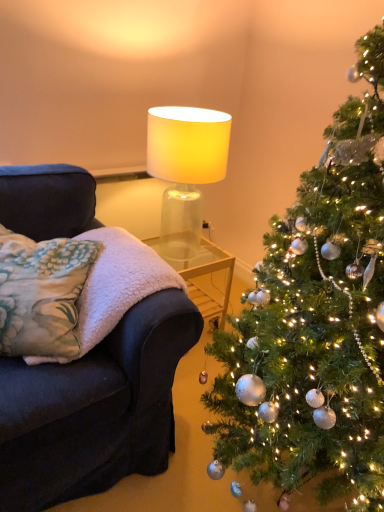
Find the location of a particular element. The height and width of the screenshot is (512, 384). fluffy floral pillow at left is located at coordinates (42, 293).

What do you see at coordinates (42, 293) in the screenshot?
I see `fluffy floral pillow at left` at bounding box center [42, 293].

Identify the location of translucent glass lampshade at upper center. (185, 169).

Does translucent glass lampshade at upper center turn towards fluffy white blanket at left?

Yes, translucent glass lampshade at upper center is oriented towards fluffy white blanket at left.

Which of these two, translucent glass lampshade at upper center or fluffy white blanket at left, is thinner?

With smaller width is translucent glass lampshade at upper center.

From a real-world perspective, is translucent glass lampshade at upper center under fluffy white blanket at left?

No, from a real-world perspective, translucent glass lampshade at upper center is not under fluffy white blanket at left.

Between translucent glass lampshade at upper center and fluffy white blanket at left, which one has smaller size?

With smaller size is translucent glass lampshade at upper center.

Which is correct: shiny silver ornaments at right is inside translucent glass lampshade at upper center, or outside of it?

shiny silver ornaments at right lies outside translucent glass lampshade at upper center.

Between shiny silver ornaments at right and translucent glass lampshade at upper center, which one has larger size?

Bigger between the two is shiny silver ornaments at right.

Is shiny silver ornaments at right far from translucent glass lampshade at upper center?

That's not correct — shiny silver ornaments at right is a little close to translucent glass lampshade at upper center.

From the image's perspective, which one is positioned lower, shiny silver ornaments at right or translucent glass lampshade at upper center?

From the image's view, shiny silver ornaments at right is below.

Considering their positions, is fluffy white blanket at left located in front of or behind translucent glass lampshade at upper center?

Clearly, fluffy white blanket at left is in front of translucent glass lampshade at upper center.

This screenshot has width=384, height=512. What are the coordinates of `blanket on the left side of translucent glass lampshade at upper center` in the screenshot? It's located at (118, 282).

Is fluffy white blanket at left facing towards translucent glass lampshade at upper center?

No, fluffy white blanket at left is not oriented towards translucent glass lampshade at upper center.

Considering the sizes of objects fluffy floral pillow at left and translucent glass lampshade at upper center in the image provided, who is shorter, fluffy floral pillow at left or translucent glass lampshade at upper center?

Standing shorter between the two is fluffy floral pillow at left.

Is fluffy floral pillow at left oriented towards translucent glass lampshade at upper center?

No, fluffy floral pillow at left is not turned towards translucent glass lampshade at upper center.

Between fluffy floral pillow at left and translucent glass lampshade at upper center, which one has larger width?

fluffy floral pillow at left.

Is the surface of fluffy floral pillow at left in direct contact with translucent glass lampshade at upper center?

fluffy floral pillow at left and translucent glass lampshade at upper center are clearly separated.

From a real-world perspective, is fluffy floral pillow at left above or below shiny silver ornaments at right?

From a real-world perspective, fluffy floral pillow at left is physically below shiny silver ornaments at right.

Can you confirm if fluffy floral pillow at left is thinner than shiny silver ornaments at right?

Yes.

Can you confirm if translucent glass lampshade at upper center is thinner than fluffy floral pillow at left?

Yes, translucent glass lampshade at upper center is thinner than fluffy floral pillow at left.

Is translucent glass lampshade at upper center facing away from fluffy floral pillow at left?

No, fluffy floral pillow at left is not at the back of translucent glass lampshade at upper center.

Considering the positions of points (152, 155) and (23, 243), is point (152, 155) farther from camera compared to point (23, 243)?

Yes, it is.

Do you think fluffy white blanket at left is within shiny silver ornaments at right, or outside of it?

fluffy white blanket at left is spatially situated outside shiny silver ornaments at right.

Which object is positioned more to the left, fluffy white blanket at left or shiny silver ornaments at right?

fluffy white blanket at left is more to the left.

From a real-world perspective, who is located higher, fluffy white blanket at left or shiny silver ornaments at right?

shiny silver ornaments at right.

Where is `blanket below the shiny silver ornaments at right (from a real-world perspective)`? blanket below the shiny silver ornaments at right (from a real-world perspective) is located at coordinates (118, 282).

What are the coordinates of `lamp above the fluffy white blanket at left (from a real-world perspective)` in the screenshot? It's located at 185,169.

In order to click on lamp behind the shiny silver ornaments at right in this screenshot , I will do `click(185, 169)`.

When comparing their distances from fluffy white blanket at left, does fluffy floral pillow at left or translucent glass lampshade at upper center seem further?

translucent glass lampshade at upper center is positioned further to the anchor fluffy white blanket at left.

When comparing their distances from shiny silver ornaments at right, does fluffy white blanket at left or translucent glass lampshade at upper center seem closer?

Among the two, fluffy white blanket at left is located nearer to shiny silver ornaments at right.

Which object lies further to the anchor point fluffy floral pillow at left, translucent glass lampshade at upper center or fluffy white blanket at left?

translucent glass lampshade at upper center is positioned further to the anchor fluffy floral pillow at left.

From the image, which object appears to be nearer to fluffy floral pillow at left, fluffy white blanket at left or shiny silver ornaments at right?

fluffy white blanket at left.

From the image, which object appears to be farther from translucent glass lampshade at upper center, fluffy white blanket at left or shiny silver ornaments at right?

shiny silver ornaments at right lies further to translucent glass lampshade at upper center than the other object.

Considering their positions, is translucent glass lampshade at upper center positioned closer to fluffy floral pillow at left than shiny silver ornaments at right?

Based on the image, shiny silver ornaments at right appears to be nearer to fluffy floral pillow at left.

Looking at the image, which one is located closer to shiny silver ornaments at right, fluffy floral pillow at left or translucent glass lampshade at upper center?

fluffy floral pillow at left is positioned closer to the anchor shiny silver ornaments at right.

Looking at the image, which one is located closer to fluffy floral pillow at left, shiny silver ornaments at right or fluffy white blanket at left?

Among the two, fluffy white blanket at left is located nearer to fluffy floral pillow at left.

Identify the location of pillow positioned between shiny silver ornaments at right and translucent glass lampshade at upper center from near to far. The image size is (384, 512). [x=42, y=293].

Where is `blanket between fluffy floral pillow at left and shiny silver ornaments at right in the horizontal direction`? This screenshot has width=384, height=512. blanket between fluffy floral pillow at left and shiny silver ornaments at right in the horizontal direction is located at coordinates (118, 282).

The height and width of the screenshot is (512, 384). Identify the location of blanket between translucent glass lampshade at upper center and fluffy floral pillow at left from top to bottom. (118, 282).

Identify the location of blanket positioned between shiny silver ornaments at right and translucent glass lampshade at upper center from near to far. (118, 282).